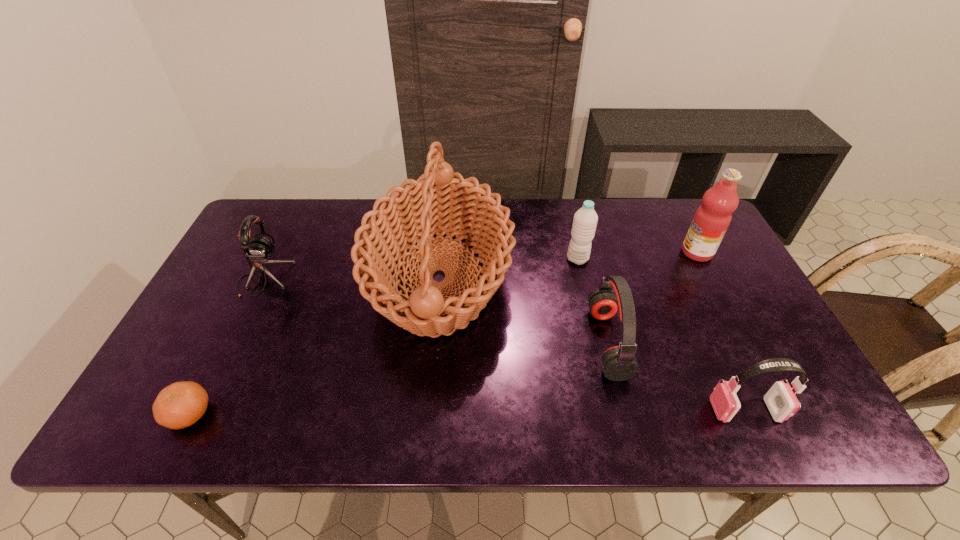
The height and width of the screenshot is (540, 960). Find the location of `vacant area situated 0.320m on the back of the shortest object`. vacant area situated 0.320m on the back of the shortest object is located at coordinates (252, 290).

The height and width of the screenshot is (540, 960). What are the coordinates of `basket located at the far edge` in the screenshot? It's located at (441, 203).

Locate an element on the screen. The height and width of the screenshot is (540, 960). fruit juice located at the far edge is located at coordinates (712, 219).

The width and height of the screenshot is (960, 540). I want to click on earphone that is at the near edge, so click(782, 403).

This screenshot has height=540, width=960. I want to click on clementine present at the near edge, so click(181, 404).

The height and width of the screenshot is (540, 960). Find the location of `earphone at the left edge`. earphone at the left edge is located at coordinates [x=259, y=250].

I want to click on clementine that is at the left edge, so click(181, 404).

Locate an element on the screen. This screenshot has height=540, width=960. fruit juice located at the right edge is located at coordinates (712, 219).

At what (x,y) coordinates should I click in order to perform the action: click on earphone located at the right edge. Please return your answer as a coordinate pair (x, y). This screenshot has width=960, height=540. Looking at the image, I should click on (782, 403).

Find the location of a particular element. The width and height of the screenshot is (960, 540). object located at the near left corner is located at coordinates (181, 404).